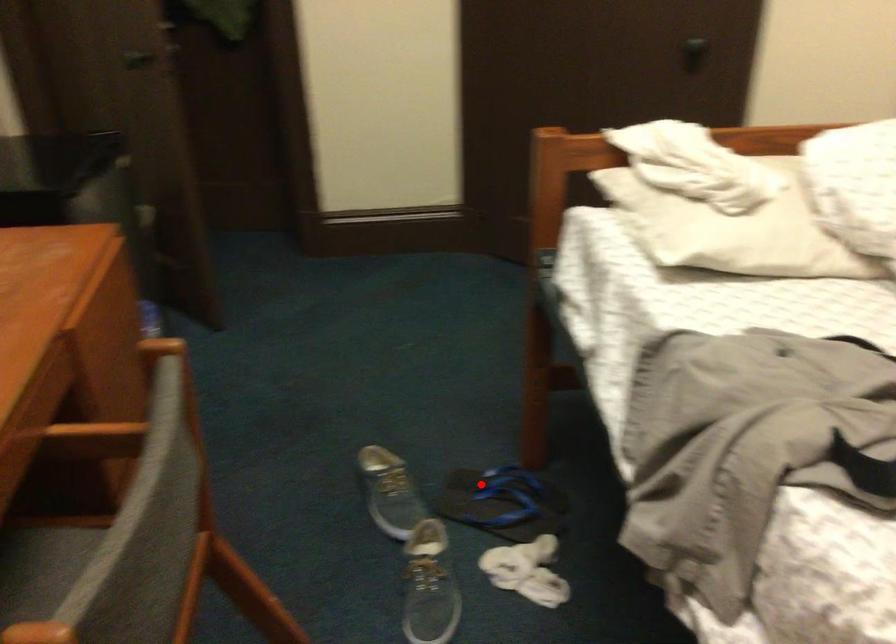
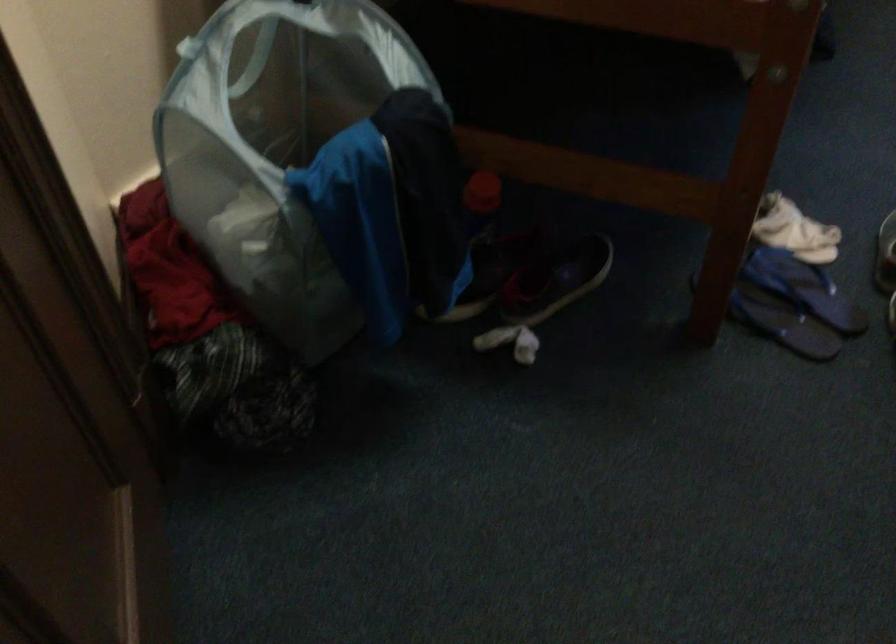
Question: I am providing you with two images of the same scene from different viewpoints. Image1 has a red point marked. In image2, the corresponding 3D location appears at what relative position? Reply with the corresponding letter.

Choices:
 (A) Closer
 (B) Farther

Answer: (A)